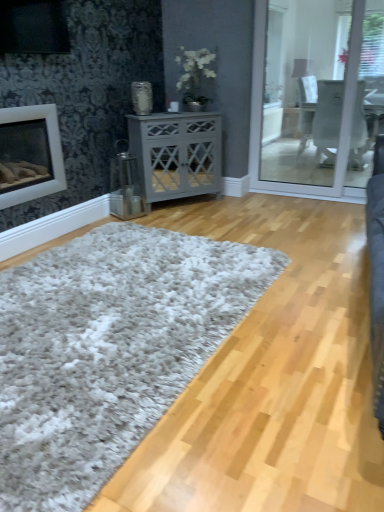
Question: Is the position of white shaggy rug at center more distant than that of white matte fireplace at left?

Choices:
 (A) yes
 (B) no

Answer: (B)

Question: Can you confirm if white shaggy rug at center is positioned to the right of white matte fireplace at left?

Choices:
 (A) no
 (B) yes

Answer: (B)

Question: Is white shaggy rug at center turned away from white matte fireplace at left?

Choices:
 (A) yes
 (B) no

Answer: (B)

Question: Is there a large distance between white shaggy rug at center and white matte fireplace at left?

Choices:
 (A) yes
 (B) no

Answer: (A)

Question: Does white shaggy rug at center contain white matte fireplace at left?

Choices:
 (A) no
 (B) yes

Answer: (A)

Question: Considering the relative positions of white shaggy rug at center and white matte fireplace at left in the image provided, is white shaggy rug at center to the left or to the right of white matte fireplace at left?

Choices:
 (A) right
 (B) left

Answer: (A)

Question: From a real-world perspective, is white shaggy rug at center physically located above or below white matte fireplace at left?

Choices:
 (A) above
 (B) below

Answer: (B)

Question: Would you say white shaggy rug at center is inside or outside white matte fireplace at left?

Choices:
 (A) inside
 (B) outside

Answer: (B)

Question: From the image's perspective, is white shaggy rug at center located above or below white matte fireplace at left?

Choices:
 (A) above
 (B) below

Answer: (B)

Question: Would you say white matte fireplace at left is to the left or to the right of white shaggy rug at center in the picture?

Choices:
 (A) right
 (B) left

Answer: (B)

Question: Considering their positions, is white matte fireplace at left located in front of or behind white shaggy rug at center?

Choices:
 (A) behind
 (B) front

Answer: (A)

Question: Is white matte fireplace at left spatially inside white shaggy rug at center, or outside of it?

Choices:
 (A) inside
 (B) outside

Answer: (B)

Question: From the image's perspective, is white matte fireplace at left located above or below white shaggy rug at center?

Choices:
 (A) above
 (B) below

Answer: (A)

Question: From their relative heights in the image, would you say white shaggy rug at center is taller or shorter than gray matte cabinet at center?

Choices:
 (A) short
 (B) tall

Answer: (A)

Question: From a real-world perspective, is white shaggy rug at center physically located above or below gray matte cabinet at center?

Choices:
 (A) above
 (B) below

Answer: (B)